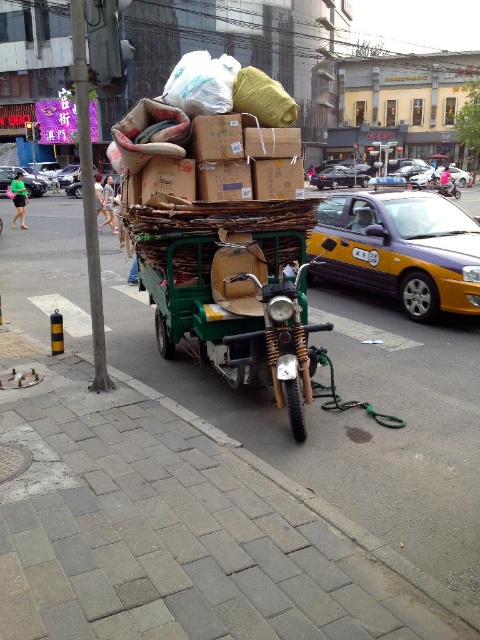
Question: Is shiny black sedan at left below metallic silver motorcycle at center?

Choices:
 (A) yes
 (B) no

Answer: (B)

Question: Which of the following is the closest to the observer?

Choices:
 (A) shiny black sedan at center
 (B) green matte tricycle at center

Answer: (B)

Question: Which point is closer to the camera taking this photo?

Choices:
 (A) (12, 172)
 (B) (444, 180)
 (C) (217, 298)
 (D) (324, 170)

Answer: (C)

Question: Among these points, which one is farthest from the camera?

Choices:
 (A) (8, 182)
 (B) (455, 195)

Answer: (A)

Question: Is green matte tricycle at center to the left of shiny black sedan at left from the viewer's perspective?

Choices:
 (A) no
 (B) yes

Answer: (A)

Question: Does yellow metallic taxi at center right appear on the left side of shiny black sedan at center?

Choices:
 (A) no
 (B) yes

Answer: (B)